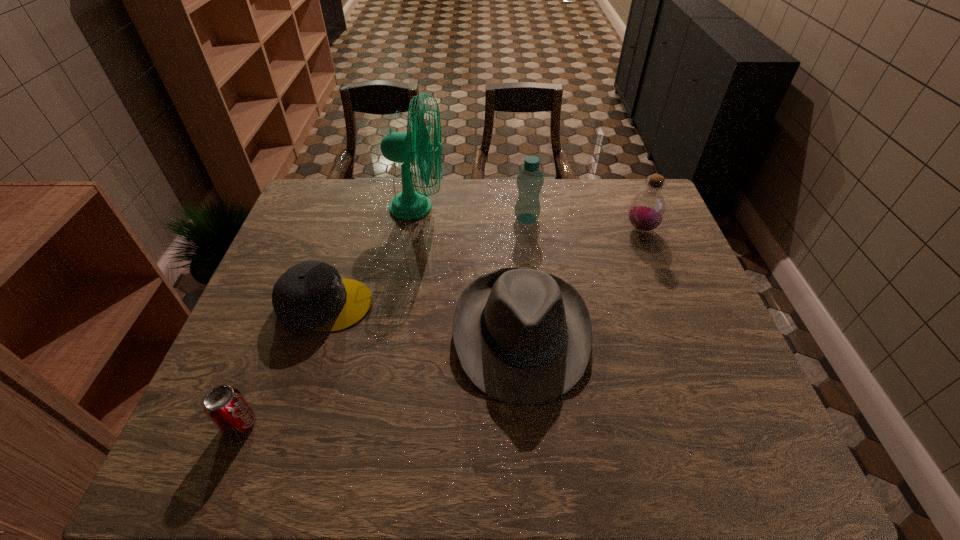
At what (x,y) coordinates should I click in order to perform the action: click on the tallest object. Please return your answer as a coordinate pair (x, y). Image resolution: width=960 pixels, height=540 pixels. Looking at the image, I should click on (416, 144).

This screenshot has width=960, height=540. Identify the location of the left bottle. (530, 179).

This screenshot has width=960, height=540. Identify the location of the right bottle. (647, 210).

This screenshot has height=540, width=960. In order to click on the third shortest object in this screenshot , I will do `click(522, 336)`.

This screenshot has width=960, height=540. Find the location of `soda can`. soda can is located at coordinates (225, 406).

Where is `cap`? Image resolution: width=960 pixels, height=540 pixels. cap is located at coordinates click(x=310, y=296).

At what (x,y) coordinates should I click in order to perform the action: click on free spot located 0.390m in front of the fan to blow air. Please return your answer as a coordinate pair (x, y). The image size is (960, 540). Looking at the image, I should click on (564, 207).

Locate an element on the screen. This screenshot has width=960, height=540. free space located 0.290m on the front of the left bottle is located at coordinates (536, 296).

At what (x,y) coordinates should I click in order to perform the action: click on vacant space situated 0.230m on the front of the rightmost object. Please return your answer as a coordinate pair (x, y). Image resolution: width=960 pixels, height=540 pixels. Looking at the image, I should click on (668, 298).

This screenshot has height=540, width=960. I want to click on free point located on the front-facing side of the fedora, so click(532, 467).